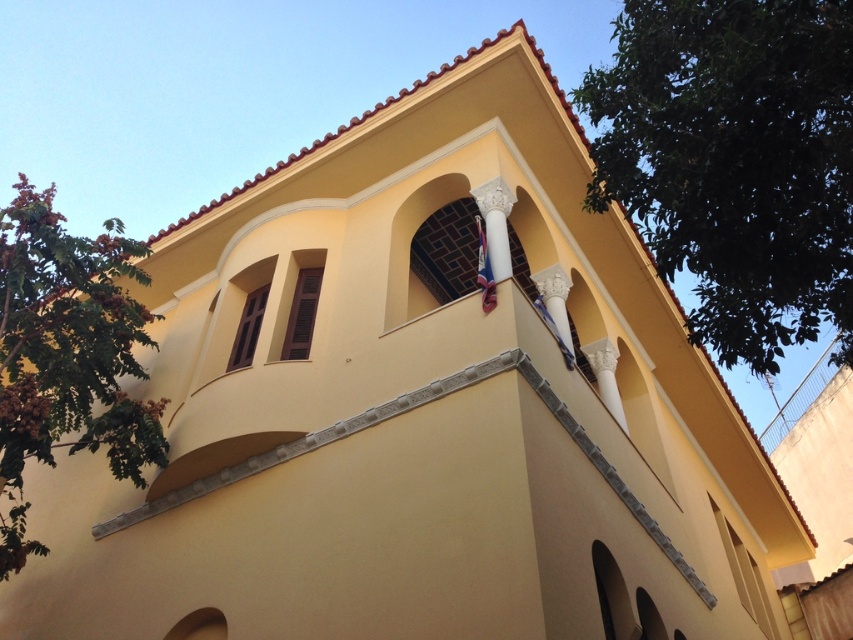
Is point (751, 257) farther from viewer compared to point (18, 515)?

No, (751, 257) is closer to viewer.

Which is behind, point (833, 67) or point (126, 413)?

Point (126, 413)

Where is `green leafy tree at upper right`? This screenshot has height=640, width=853. green leafy tree at upper right is located at coordinates (734, 163).

Where is `green leafy tree at upper right`? green leafy tree at upper right is located at coordinates (734, 163).